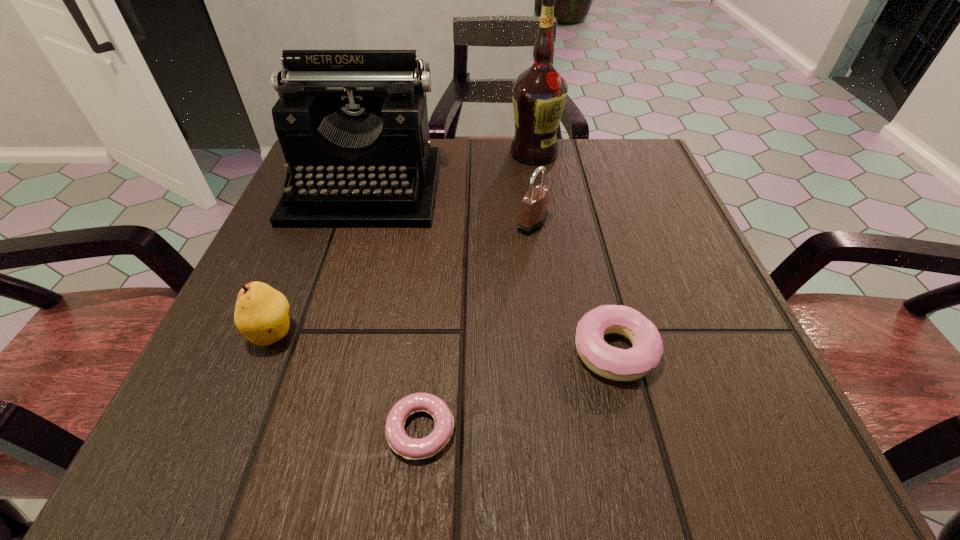
Find the location of a particular element. object that is at the far left corner is located at coordinates (353, 127).

In the image, there is a desktop. At what (x,y) coordinates should I click in order to perform the action: click on vacant space at the far edge. Please return your answer as a coordinate pair (x, y). The height and width of the screenshot is (540, 960). Looking at the image, I should click on (565, 143).

Image resolution: width=960 pixels, height=540 pixels. In order to click on free space at the near edge of the desktop in this screenshot , I will do `click(414, 428)`.

Identify the location of blank area at the left edge. The width and height of the screenshot is (960, 540). (272, 271).

The height and width of the screenshot is (540, 960). In the image, there is a desktop. In order to click on vacant space at the right edge in this screenshot , I will do `click(649, 284)`.

This screenshot has height=540, width=960. What are the coordinates of `vacant space at the near left corner` in the screenshot? It's located at pos(208,411).

The image size is (960, 540). What are the coordinates of `free space at the far right corner of the desktop` in the screenshot? It's located at (630, 187).

You are a GUI agent. You are given a task and a screenshot of the screen. Output one action in this format:
    pyautogui.click(x=<x>, y=<y>)
    Task: Click on the unoccupied position between the third shortest object and the typewriter
    The image size is (960, 540).
    Given the screenshot: What is the action you would take?
    pyautogui.click(x=319, y=260)

Find the location of a particular element. free space between the fourth shortest object and the nearest object is located at coordinates tap(476, 327).

Where is `free space between the taller doughnut and the third shortest object`? This screenshot has height=540, width=960. free space between the taller doughnut and the third shortest object is located at coordinates (444, 342).